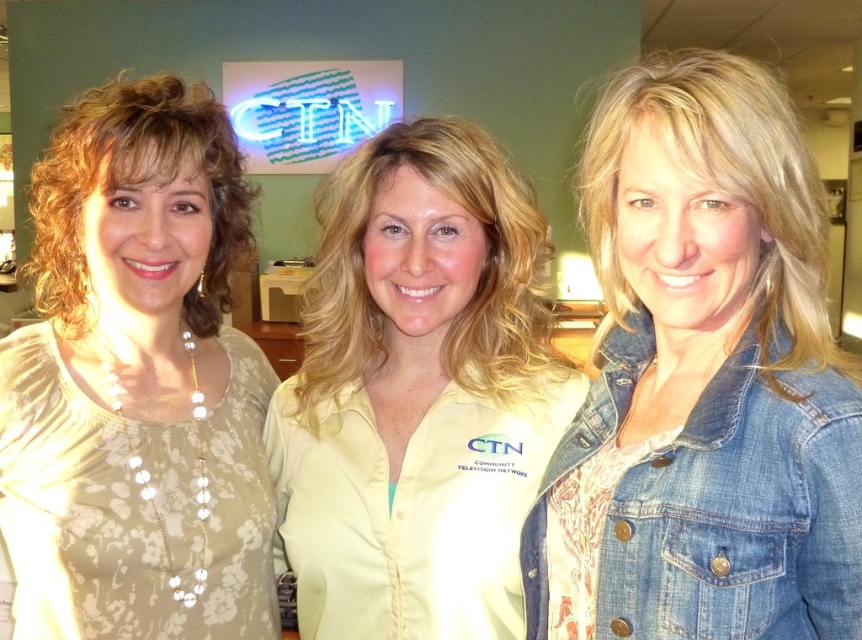
Between point (111, 376) and point (588, 440), which one is positioned in front?

Point (588, 440)

Who is more distant from viewer, (204, 557) or (667, 538)?

Point (204, 557)

Which is in front, point (188, 598) or point (661, 548)?

Positioned in front is point (661, 548).

At what (x,y) coordinates should I click in order to perform the action: click on matte beige blouse at left. Please return your answer as a coordinate pair (x, y). Looking at the image, I should click on (136, 384).

Which is in front, point (42, 324) or point (348, 490)?

Point (348, 490)

Does matte beige blouse at left appear under yellow button-down shirt at center?

Indeed, matte beige blouse at left is positioned under yellow button-down shirt at center.

This screenshot has width=862, height=640. I want to click on matte beige blouse at left, so click(136, 384).

This screenshot has width=862, height=640. Identify the location of matte beige blouse at left. (136, 384).

Can you confirm if yellow button-down shirt at center is positioned above denim jacket at lower right?

Indeed, yellow button-down shirt at center is positioned over denim jacket at lower right.

Describe the element at coordinates (417, 394) in the screenshot. I see `yellow button-down shirt at center` at that location.

Which is in front, point (467, 346) or point (776, 323)?

Point (776, 323) is in front.

What are the coordinates of `yellow button-down shirt at center` in the screenshot? It's located at (417, 394).